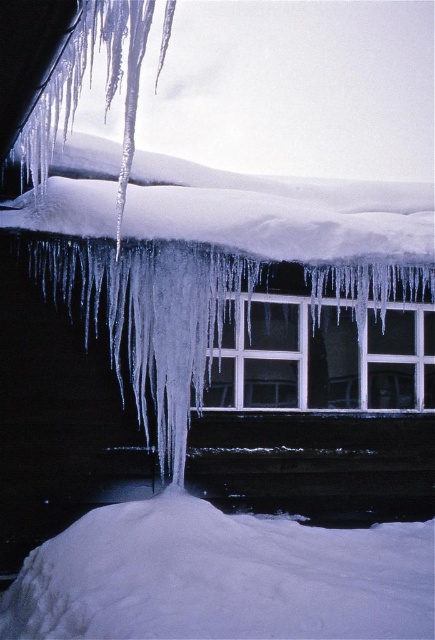
You are a delivery person trying to place a package on the ground. The package is 1 meter wide. You see the white fluffy snow at lower center and the white matte window at center. Can the snow area accommodate the package without it touching the window?

The white fluffy snow at lower center might be wider than the white matte window at center, so there is a possibility that the snow area is wide enough to place the package without touching the window. However, since the exact width isn not specified, there is some uncertainty.

Based on the photo, you are a photographer standing in front of the snowy house. You want to take a photo that includes both the point at coordinates point (94, 538) and point (368, 374). Which point will appear larger in the photo?

Point (94, 538) is closer to the camera than point (368, 374), so it will appear larger in the photo.

You are standing at the entrance of the house and want to place a small decorative ornament on the white fluffy snow at lower center. According to the coordinates provided, where exactly should you aim to place it?

The white fluffy snow at lower center is located at point (220, 577), so you should aim for that coordinate to place the ornament there.